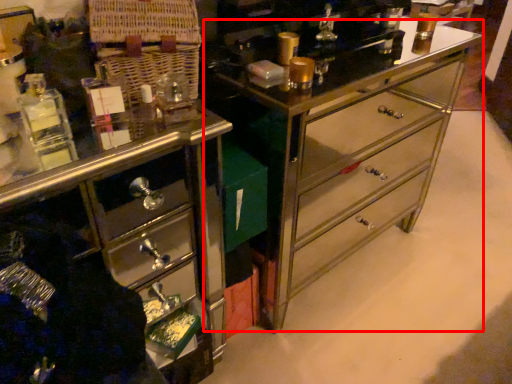
Question: From the image's perspective, considering the relative positions of counter (annotated by the red box) and chest of drawers in the image provided, where is counter (annotated by the red box) located with respect to the staircase?

Choices:
 (A) above
 (B) below

Answer: (A)